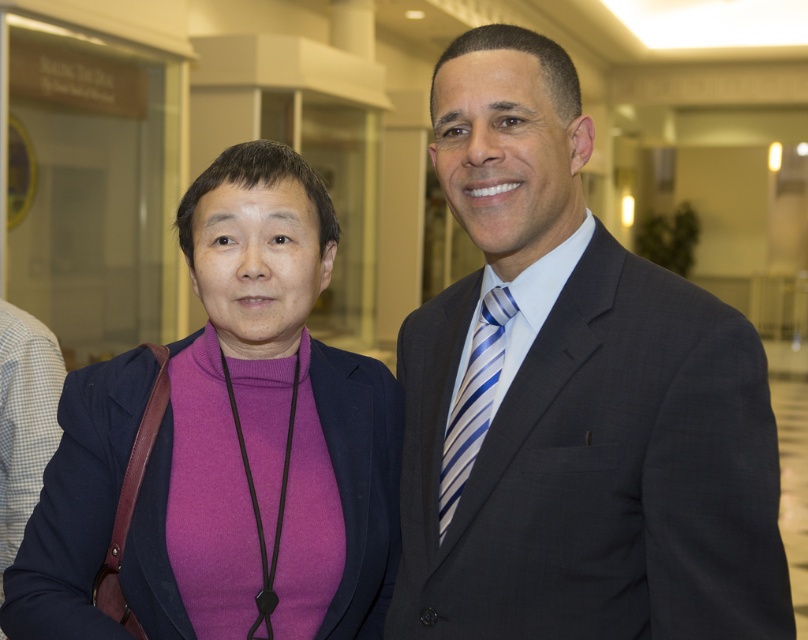
Does purple matte sweater at center lie behind blue striped tie at center?

No, it is in front of blue striped tie at center.

Does purple matte sweater at center appear under blue striped tie at center?

No.

Who is more forward, [351,451] or [495,348]?

Point [495,348]

Where is `purple matte sweater at center`? The width and height of the screenshot is (808, 640). purple matte sweater at center is located at coordinates (266, 426).

Who is higher up, dark gray suit at center or blue striped tie at center?

Positioned higher is dark gray suit at center.

This screenshot has width=808, height=640. Describe the element at coordinates (571, 400) in the screenshot. I see `dark gray suit at center` at that location.

Is point (493, 397) closer to camera compared to point (482, 342)?

That is True.

I want to click on dark gray suit at center, so click(x=571, y=400).

Which is more to the left, dark gray suit at center or purple matte sweater at center?

Positioned to the left is purple matte sweater at center.

In the scene shown: Who is more distant from viewer, (533,51) or (192,488)?

Positioned behind is point (192,488).

Is point (516, 141) farther from camera compared to point (175, 401)?

No, it is not.

This screenshot has height=640, width=808. Identify the location of dark gray suit at center. (571, 400).